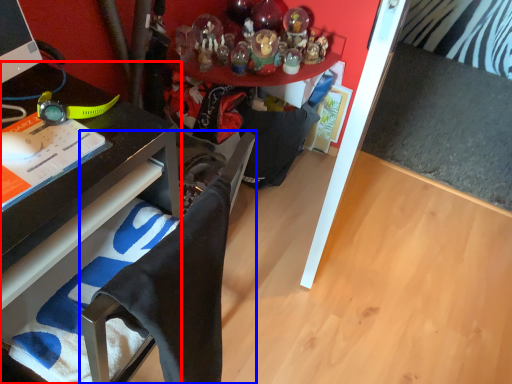
Question: Which point is closer to the camera, desk (highlighted by a red box) or computer chair (highlighted by a blue box)?

Choices:
 (A) desk
 (B) computer chair

Answer: (B)